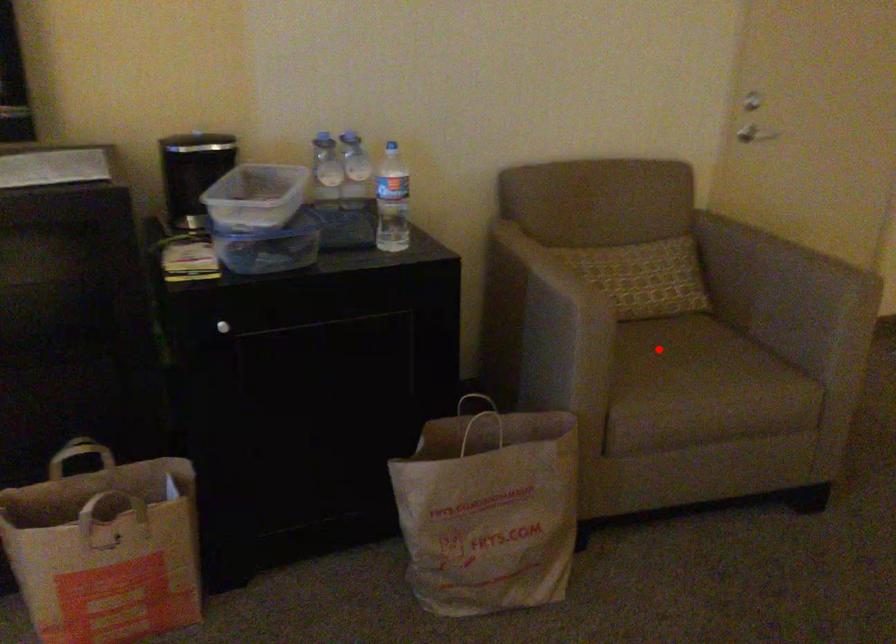
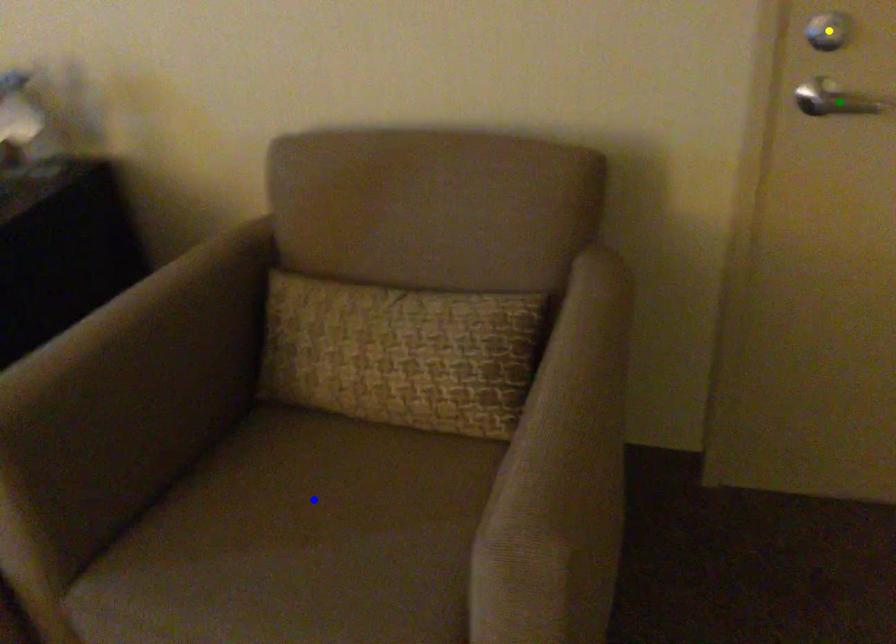
Question: I am providing you with two images of the same scene from different viewpoints. A red point is marked on the first image. You are given multiple points on the second image. Which point in image 2 represents the same 3d spot as the red point in image 1?

Choices:
 (A) blue point
 (B) yellow point
 (C) green point

Answer: (A)